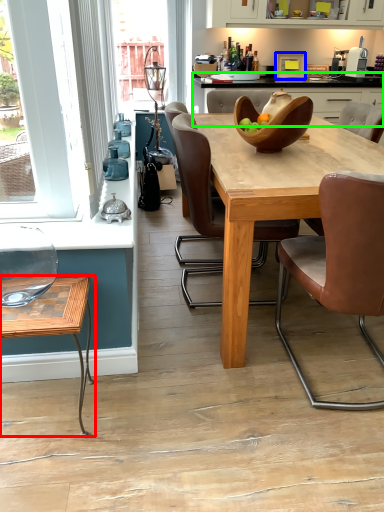
Question: Estimate the real-world distances between objects in this image. Which object is farther from coffee table (highlighted by a red box), appliance (highlighted by a blue box) or counter (highlighted by a green box)?

Choices:
 (A) appliance
 (B) counter

Answer: (A)